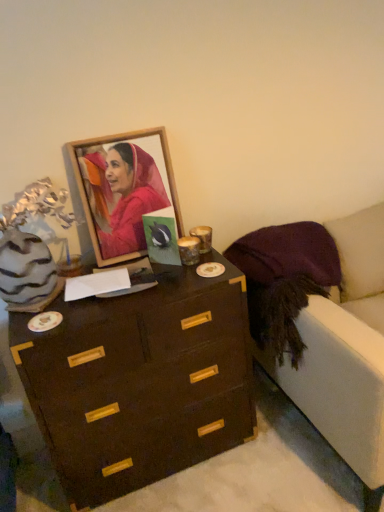
What do you see at coordinates (123, 189) in the screenshot? I see `wooden frame at upper center` at bounding box center [123, 189].

Image resolution: width=384 pixels, height=512 pixels. Describe the element at coordinates (324, 328) in the screenshot. I see `velvet purple armchair at right` at that location.

The width and height of the screenshot is (384, 512). I want to click on dark wood chest of drawers at center, so click(140, 381).

Is velvet purple armchair at right directly adjacent to wooden frame at upper center?

velvet purple armchair at right and wooden frame at upper center are not in contact.

Considering the positions of objects velvet purple armchair at right and wooden frame at upper center in the image provided, who is more to the left, velvet purple armchair at right or wooden frame at upper center?

Positioned to the left is wooden frame at upper center.

Who is smaller, velvet purple armchair at right or wooden frame at upper center?

wooden frame at upper center.

Based on their sizes in the image, would you say dark wood chest of drawers at center is bigger or smaller than velvet purple armchair at right?

In the image, dark wood chest of drawers at center appears to be smaller than velvet purple armchair at right.

Is dark wood chest of drawers at center turned away from velvet purple armchair at right?

No, dark wood chest of drawers at center is not facing away from velvet purple armchair at right.

Is dark wood chest of drawers at center situated inside velvet purple armchair at right or outside?

dark wood chest of drawers at center lies outside velvet purple armchair at right.

Is velvet purple armchair at right touching dark wood chest of drawers at center?

No, velvet purple armchair at right is not with dark wood chest of drawers at center.

How different are the orientations of velvet purple armchair at right and dark wood chest of drawers at center in degrees?

0.249 degrees separate the facing orientations of velvet purple armchair at right and dark wood chest of drawers at center.

Does velvet purple armchair at right appear on the right side of dark wood chest of drawers at center?

Indeed, velvet purple armchair at right is positioned on the right side of dark wood chest of drawers at center.

Is velvet purple armchair at right located outside dark wood chest of drawers at center?

Indeed, velvet purple armchair at right is completely outside dark wood chest of drawers at center.

Which is closer to the camera, (236, 347) or (135, 144)?

The point (135, 144) is more forward.

From the image's perspective, between dark wood chest of drawers at center and wooden frame at upper center, who is located below?

dark wood chest of drawers at center, from the image's perspective.

Which object is thinner, dark wood chest of drawers at center or wooden frame at upper center?

With smaller width is wooden frame at upper center.

Does dark wood chest of drawers at center lie behind wooden frame at upper center?

No, dark wood chest of drawers at center is closer to the camera.

Considering the points (119, 201) and (132, 479), which point is in front, point (119, 201) or point (132, 479)?

The point (119, 201) is closer to the camera.

Are wooden frame at upper center and dark wood chest of drawers at center making contact?

No, wooden frame at upper center is not with dark wood chest of drawers at center.

Which object is closer to the camera, wooden frame at upper center or dark wood chest of drawers at center?

dark wood chest of drawers at center is in front.

From a real-world perspective, who is located lower, wooden frame at upper center or dark wood chest of drawers at center?

From a 3D spatial view, dark wood chest of drawers at center is below.

Which object is more forward, wooden frame at upper center or velvet purple armchair at right?

Positioned in front is velvet purple armchair at right.

Is wooden frame at upper center wider or thinner than velvet purple armchair at right?

wooden frame at upper center is thinner than velvet purple armchair at right.

Which of these two, wooden frame at upper center or velvet purple armchair at right, stands taller?

velvet purple armchair at right.

Locate an element on the screen. The width and height of the screenshot is (384, 512). picture frame behind the velvet purple armchair at right is located at coordinates (123, 189).

The height and width of the screenshot is (512, 384). What are the coordinates of `armchair on the right side of wooden frame at upper center` in the screenshot? It's located at (324, 328).

The width and height of the screenshot is (384, 512). In order to click on the chest of drawers behind the velvet purple armchair at right in this screenshot , I will do `click(140, 381)`.

When comparing their distances from dark wood chest of drawers at center, does wooden frame at upper center or velvet purple armchair at right seem further?

Among the two, wooden frame at upper center is located further to dark wood chest of drawers at center.

Looking at the image, which one is located closer to wooden frame at upper center, dark wood chest of drawers at center or velvet purple armchair at right?

dark wood chest of drawers at center is closer to wooden frame at upper center.

Based on their spatial positions, is velvet purple armchair at right or dark wood chest of drawers at center further from wooden frame at upper center?

velvet purple armchair at right.

Looking at this image, which object lies further to the anchor point velvet purple armchair at right, wooden frame at upper center or dark wood chest of drawers at center?

Based on the image, wooden frame at upper center appears to be further to velvet purple armchair at right.

From the image, which object appears to be nearer to velvet purple armchair at right, dark wood chest of drawers at center or wooden frame at upper center?

dark wood chest of drawers at center is positioned closer to the anchor velvet purple armchair at right.

When comparing their distances from dark wood chest of drawers at center, does velvet purple armchair at right or wooden frame at upper center seem further?

Based on the image, wooden frame at upper center appears to be further to dark wood chest of drawers at center.

Locate an element on the screen. This screenshot has height=512, width=384. chest of drawers between wooden frame at upper center and velvet purple armchair at right from left to right is located at coordinates (140, 381).